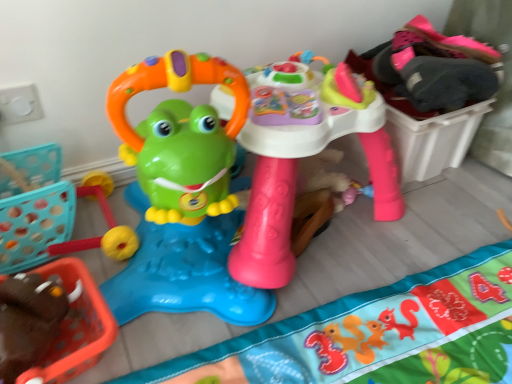
Question: Is matte plastic frog walker at center, the second toy from the right, in front of or behind matte plastic activity table at center, placed as the 1th toy when sorted from right to left, in the image?

Choices:
 (A) behind
 (B) front

Answer: (B)

Question: Considering the positions of matte plastic frog walker at center, the second toy from the right, and matte plastic activity table at center, placed as the 1th toy when sorted from right to left, in the image, is matte plastic frog walker at center, the second toy from the right, bigger or smaller than matte plastic activity table at center, placed as the 1th toy when sorted from right to left,?

Choices:
 (A) big
 (B) small

Answer: (B)

Question: Based on their relative distances, which object is nearer to the matte plastic activity table at center, placed as the 1th toy when sorted from right to left?

Choices:
 (A) matte plastic frog walker at center, the 1th toy in the left-to-right sequence
 (B) soft fabric play mat at center

Answer: (A)

Question: Estimate the real-world distances between objects in this image. Which object is farther from the soft fabric play mat at center?

Choices:
 (A) matte plastic frog walker at center, the 1th toy in the left-to-right sequence
 (B) matte plastic activity table at center, which is the second toy from left to right

Answer: (A)